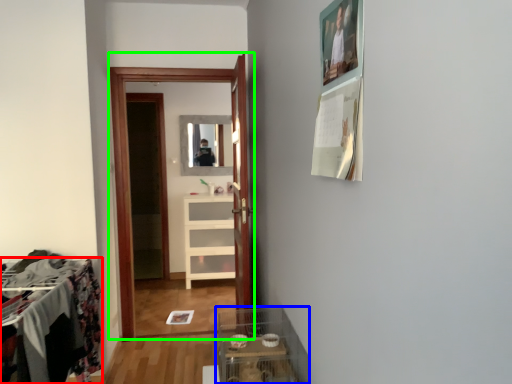
Question: Which object is positioned farthest from furniture (highlighted by a red box)? Select from glass box (highlighted by a blue box) and clothing store (highlighted by a green box).

Choices:
 (A) glass box
 (B) clothing store

Answer: (B)